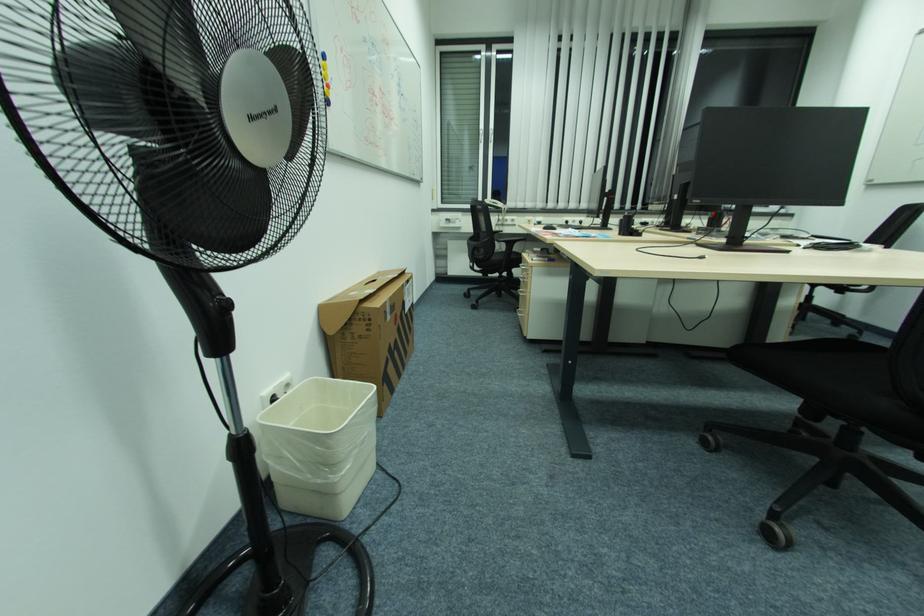
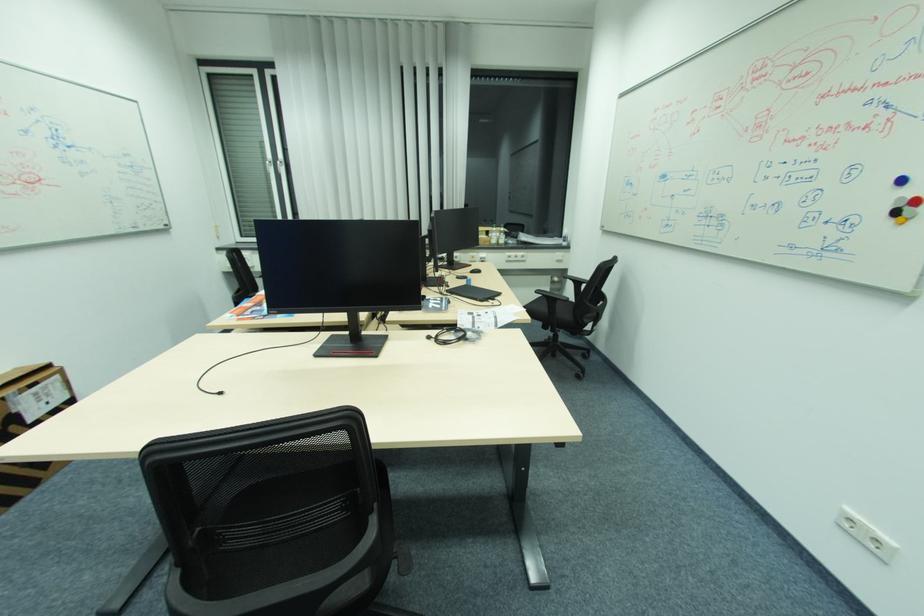
Find the pixel in the second image that matches the point at 408,286 in the first image.

(7, 399)